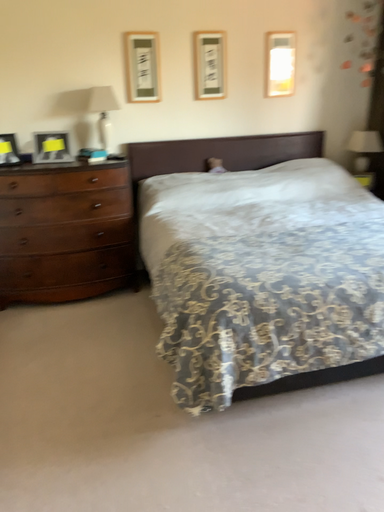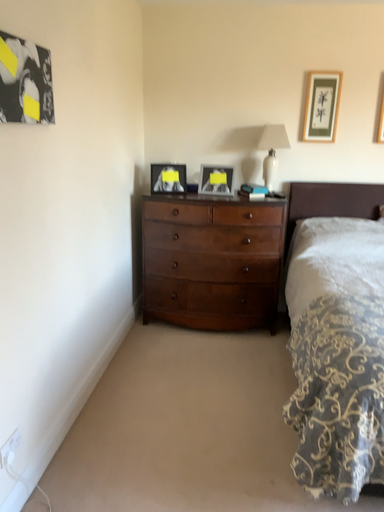
Question: How did the camera likely rotate when shooting the video?

Choices:
 (A) rotated right
 (B) rotated left

Answer: (B)